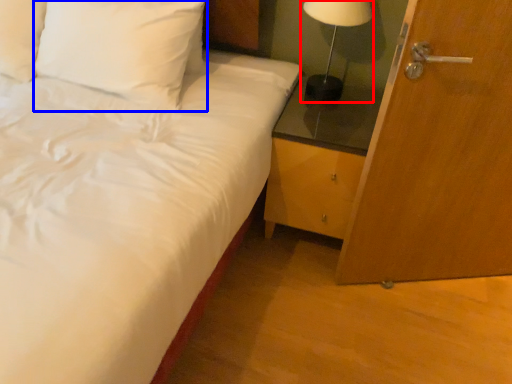
Question: Which of the following is the farthest to the observer, table lamp (highlighted by a red box) or pillow (highlighted by a blue box)?

Choices:
 (A) table lamp
 (B) pillow

Answer: (A)